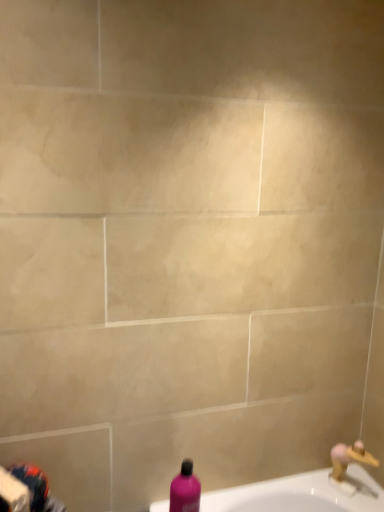
Find the location of a particular element. The width and height of the screenshot is (384, 512). pink matte bottle at lower center is located at coordinates (185, 490).

What do you see at coordinates (185, 490) in the screenshot?
I see `pink matte bottle at lower center` at bounding box center [185, 490].

What do you see at coordinates (348, 463) in the screenshot? The image size is (384, 512). I see `gold metallic faucet at lower right` at bounding box center [348, 463].

Locate an element on the screen. The image size is (384, 512). gold metallic faucet at lower right is located at coordinates (348, 463).

Where is `pink matte bottle at lower center`? pink matte bottle at lower center is located at coordinates (185, 490).

Between gold metallic faucet at lower right and pink matte bottle at lower center, which one appears on the right side from the viewer's perspective?

gold metallic faucet at lower right.

Which object is more forward, gold metallic faucet at lower right or pink matte bottle at lower center?

pink matte bottle at lower center is in front.

Which is less distant, (336, 470) or (173, 504)?

The point (173, 504) is in front.

From the image's perspective, is gold metallic faucet at lower right positioned above or below pink matte bottle at lower center?

Clearly, from the image's perspective, gold metallic faucet at lower right is below pink matte bottle at lower center.

From a real-world perspective, does gold metallic faucet at lower right sit lower than pink matte bottle at lower center?

Yes, from a real-world perspective, gold metallic faucet at lower right is under pink matte bottle at lower center.

Which object is thinner, gold metallic faucet at lower right or pink matte bottle at lower center?

gold metallic faucet at lower right is thinner.

Considering the relative sizes of gold metallic faucet at lower right and pink matte bottle at lower center in the image provided, is gold metallic faucet at lower right taller than pink matte bottle at lower center?

No, gold metallic faucet at lower right is not taller than pink matte bottle at lower center.

Is gold metallic faucet at lower right bigger or smaller than pink matte bottle at lower center?

In the image, gold metallic faucet at lower right appears to be smaller than pink matte bottle at lower center.

Do you think gold metallic faucet at lower right is within pink matte bottle at lower center, or outside of it?

gold metallic faucet at lower right exists outside the volume of pink matte bottle at lower center.

Is gold metallic faucet at lower right far away from pink matte bottle at lower center?

No, gold metallic faucet at lower right is not far away from pink matte bottle at lower center.

Is gold metallic faucet at lower right oriented towards pink matte bottle at lower center?

Yes, gold metallic faucet at lower right faces towards pink matte bottle at lower center.

Identify the location of bottle on the left of gold metallic faucet at lower right. (185, 490).

Which is more to the right, pink matte bottle at lower center or gold metallic faucet at lower right?

gold metallic faucet at lower right is more to the right.

Between pink matte bottle at lower center and gold metallic faucet at lower right, which one is positioned behind?

gold metallic faucet at lower right is further away from the camera.

Between point (172, 484) and point (346, 445), which one is positioned in front?

The point (172, 484) is more forward.

From the image's perspective, which one is positioned lower, pink matte bottle at lower center or gold metallic faucet at lower right?

gold metallic faucet at lower right, from the image's perspective.

Based on the photo, from a real-world perspective, is pink matte bottle at lower center positioned over gold metallic faucet at lower right based on gravity?

Correct, in the physical world, pink matte bottle at lower center is higher than gold metallic faucet at lower right.

Between pink matte bottle at lower center and gold metallic faucet at lower right, which one has smaller width?

With smaller width is gold metallic faucet at lower right.

Between pink matte bottle at lower center and gold metallic faucet at lower right, which one has less height?

Standing shorter between the two is gold metallic faucet at lower right.

Which of these two, pink matte bottle at lower center or gold metallic faucet at lower right, is smaller?

gold metallic faucet at lower right is smaller.

Would you say pink matte bottle at lower center is outside gold metallic faucet at lower right?

Indeed, pink matte bottle at lower center is completely outside gold metallic faucet at lower right.

Are pink matte bottle at lower center and gold metallic faucet at lower right making contact?

No, pink matte bottle at lower center is not beside gold metallic faucet at lower right.

Does pink matte bottle at lower center turn towards gold metallic faucet at lower right?

No, pink matte bottle at lower center does not turn towards gold metallic faucet at lower right.

This screenshot has height=512, width=384. I want to click on tap beneath the pink matte bottle at lower center (from a real-world perspective), so click(348, 463).

At what (x,y) coordinates should I click in order to perform the action: click on tap below the pink matte bottle at lower center (from the image's perspective). Please return your answer as a coordinate pair (x, y). Image resolution: width=384 pixels, height=512 pixels. Looking at the image, I should click on (348, 463).

What are the coordinates of `bottle above the gold metallic faucet at lower right (from the image's perspective)` in the screenshot? It's located at (185, 490).